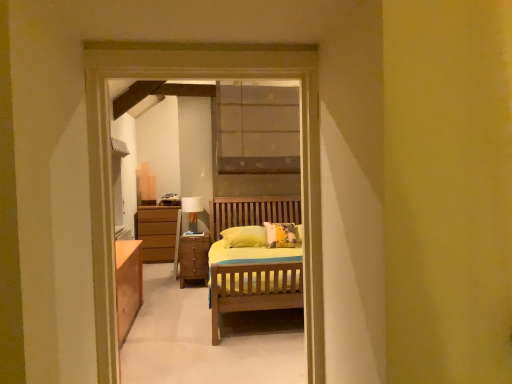
Where is `wooden chest of drawers at center`? The image size is (512, 384). wooden chest of drawers at center is located at coordinates (193, 258).

Describe the element at coordinates (193, 258) in the screenshot. The image size is (512, 384). I see `wooden chest of drawers at center` at that location.

In order to face wooden chest of drawers at center, should I rotate leftwards or rightwards?

To face it directly, rotate left by 8.146 degrees.

Locate an element on the screen. The width and height of the screenshot is (512, 384). white fabric-covered table lamp at center is located at coordinates [x=192, y=211].

What do you see at coordinates (192, 211) in the screenshot?
I see `white fabric-covered table lamp at center` at bounding box center [192, 211].

Find the location of a particular element. Image resolution: width=512 pixels, height=384 pixels. wooden chest of drawers at center is located at coordinates (193, 258).

Can you confirm if white fabric-covered table lamp at center is positioned to the left of wooden chest of drawers at center?

Yes.

In the image, is white fabric-covered table lamp at center positioned in front of or behind wooden chest of drawers at center?

Visually, white fabric-covered table lamp at center is located behind wooden chest of drawers at center.

Between point (194, 218) and point (207, 268), which one is positioned behind?

The point (194, 218) is farther from the camera.

From the image's perspective, between white fabric-covered table lamp at center and wooden chest of drawers at center, which one is located above?

From the image's view, white fabric-covered table lamp at center is above.

From a real-world perspective, is white fabric-covered table lamp at center above or below wooden chest of drawers at center?

white fabric-covered table lamp at center is situated higher than wooden chest of drawers at center in the real world.

Which object is thinner, white fabric-covered table lamp at center or wooden chest of drawers at center?

Thinner between the two is white fabric-covered table lamp at center.

Does white fabric-covered table lamp at center have a lesser height compared to wooden chest of drawers at center?

Yes, white fabric-covered table lamp at center is shorter than wooden chest of drawers at center.

In the scene shown: Is white fabric-covered table lamp at center bigger or smaller than wooden chest of drawers at center?

Clearly, white fabric-covered table lamp at center is smaller in size than wooden chest of drawers at center.

Does white fabric-covered table lamp at center contain wooden chest of drawers at center?

That's incorrect, wooden chest of drawers at center is not inside white fabric-covered table lamp at center.

Is there a large distance between white fabric-covered table lamp at center and wooden chest of drawers at center?

No, white fabric-covered table lamp at center is in close proximity to wooden chest of drawers at center.

Could you tell me if white fabric-covered table lamp at center is turned towards wooden chest of drawers at center?

No.

How different are the orientations of white fabric-covered table lamp at center and wooden chest of drawers at center in degrees?

They differ by 1.88e-05 degrees in their facing directions.

From the picture: Measure the distance between white fabric-covered table lamp at center and wooden chest of drawers at center.

A distance of 15.08 inches exists between white fabric-covered table lamp at center and wooden chest of drawers at center.

The height and width of the screenshot is (384, 512). Identify the location of chest of drawers below the white fabric-covered table lamp at center (from a real-world perspective). (193, 258).

Does wooden chest of drawers at center appear on the left side of white fabric-covered table lamp at center?

No.

Is wooden chest of drawers at center in front of white fabric-covered table lamp at center?

Yes, the depth of wooden chest of drawers at center is less than that of white fabric-covered table lamp at center.

Considering the points (199, 242) and (188, 203), which point is in front, point (199, 242) or point (188, 203)?

Point (199, 242)

From the image's perspective, relative to white fabric-covered table lamp at center, is wooden chest of drawers at center above or below?

wooden chest of drawers at center is below white fabric-covered table lamp at center.

From a real-world perspective, is wooden chest of drawers at center under white fabric-covered table lamp at center?

Yes, from a real-world perspective, wooden chest of drawers at center is beneath white fabric-covered table lamp at center.

Is wooden chest of drawers at center wider or thinner than white fabric-covered table lamp at center?

Considering their sizes, wooden chest of drawers at center looks broader than white fabric-covered table lamp at center.

Considering the relative sizes of wooden chest of drawers at center and white fabric-covered table lamp at center in the image provided, is wooden chest of drawers at center taller than white fabric-covered table lamp at center?

Correct, wooden chest of drawers at center is much taller as white fabric-covered table lamp at center.

Is wooden chest of drawers at center smaller than white fabric-covered table lamp at center?

No.

Is wooden chest of drawers at center not within white fabric-covered table lamp at center?

Yes.

Would you say wooden chest of drawers at center is a long distance from white fabric-covered table lamp at center?

No.

Is wooden chest of drawers at center positioned with its back to white fabric-covered table lamp at center?

wooden chest of drawers at center is not turned away from white fabric-covered table lamp at center.

What's the angular difference between wooden chest of drawers at center and white fabric-covered table lamp at center's facing directions?

1.88e-05 degrees.

Where is `the chest of drawers below the white fabric-covered table lamp at center (from a real-world perspective)`? Image resolution: width=512 pixels, height=384 pixels. the chest of drawers below the white fabric-covered table lamp at center (from a real-world perspective) is located at coordinates [x=193, y=258].

The image size is (512, 384). Identify the location of the chest of drawers located in front of the white fabric-covered table lamp at center. (193, 258).

Locate an element on the screen. This screenshot has width=512, height=384. the chest of drawers lying below the white fabric-covered table lamp at center (from the image's perspective) is located at coordinates (193, 258).